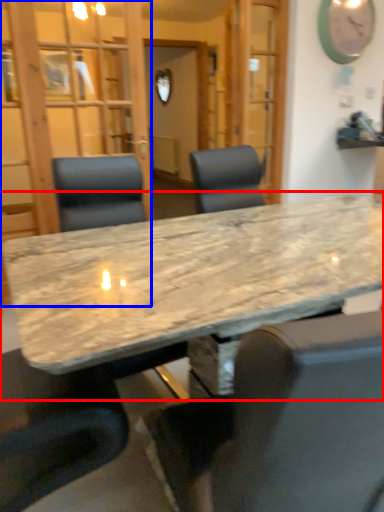
Question: Which object is closer to the camera taking this photo, table (highlighted by a red box) or glass door (highlighted by a blue box)?

Choices:
 (A) table
 (B) glass door

Answer: (A)